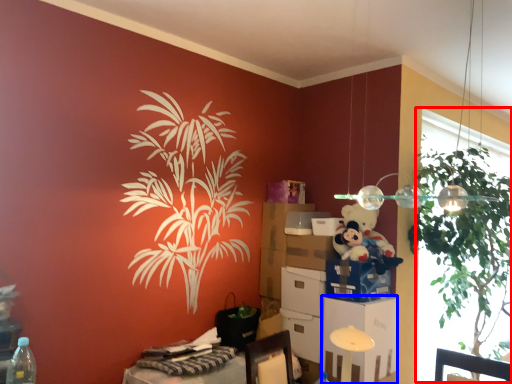
Question: Which object appears farthest to the camera in this image, window screen (highlighted by a red box) or file cabinet (highlighted by a blue box)?

Choices:
 (A) window screen
 (B) file cabinet

Answer: (B)